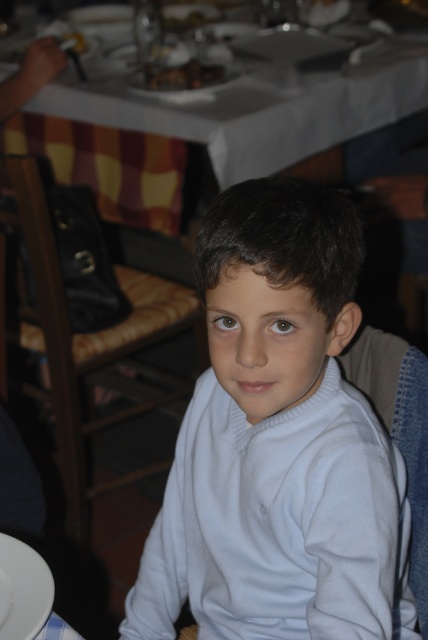
Question: Does white woolen sweater at center have a larger size compared to golden brown bread at upper center?

Choices:
 (A) no
 (B) yes

Answer: (B)

Question: Which object appears closest to the camera in this image?

Choices:
 (A) white woolen sweater at center
 (B) white glossy plate at lower left
 (C) white tablecloth at upper center
 (D) golden brown bread at upper center

Answer: (A)

Question: Which point is farther to the camera?

Choices:
 (A) (5, 634)
 (B) (193, 77)

Answer: (B)

Question: Does white tablecloth at upper center have a larger size compared to golden brown bread at upper center?

Choices:
 (A) yes
 (B) no

Answer: (A)

Question: Can you confirm if white woolen sweater at center is positioned to the left of white glossy plate at lower left?

Choices:
 (A) yes
 (B) no

Answer: (B)

Question: Which point appears closest to the camera in this image?

Choices:
 (A) (x=193, y=83)
 (B) (x=38, y=566)
 (C) (x=392, y=77)
 (D) (x=249, y=276)

Answer: (D)